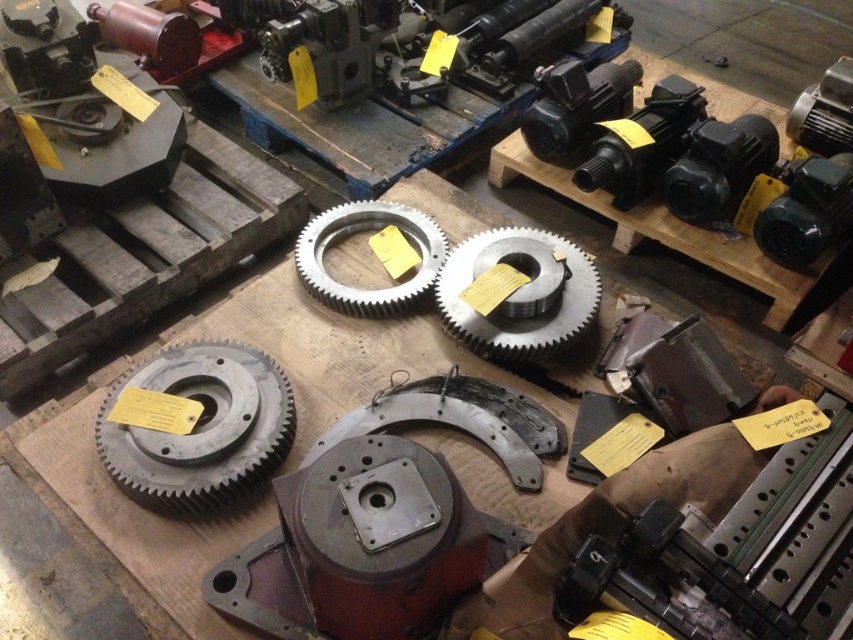
Can you confirm if gray metallic gear at center is positioned above metallic gray gear at center?

No.

Does point (204, 426) come in front of point (514, 301)?

Yes, point (204, 426) is in front of point (514, 301).

Does point (276, 416) come farther from viewer compared to point (436, 280)?

No.

Find the location of a particular element. gray metallic gear at center is located at coordinates (200, 428).

Is metallic gray gear at center bigger than matte gray gear at center?

Incorrect, metallic gray gear at center is not larger than matte gray gear at center.

Describe the element at coordinates (520, 292) in the screenshot. The image size is (853, 640). I see `metallic gray gear at center` at that location.

Who is more forward, (x=518, y=244) or (x=424, y=278)?

Positioned in front is point (x=518, y=244).

Locate an element on the screen. The width and height of the screenshot is (853, 640). metallic gray gear at center is located at coordinates (520, 292).

Is gray metallic gear at center thinner than matte gray gear at center?

No.

Does gray metallic gear at center have a larger size compared to matte gray gear at center?

A: Indeed, gray metallic gear at center has a larger size compared to matte gray gear at center.

Does point (142, 474) come farther from viewer compared to point (379, 304)?

That is False.

The image size is (853, 640). Identify the location of gray metallic gear at center. point(200,428).